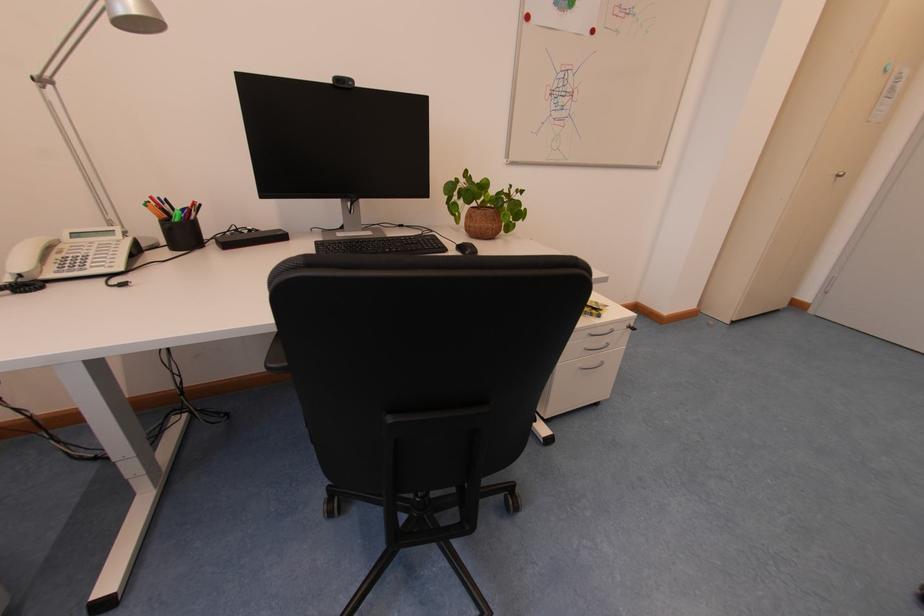
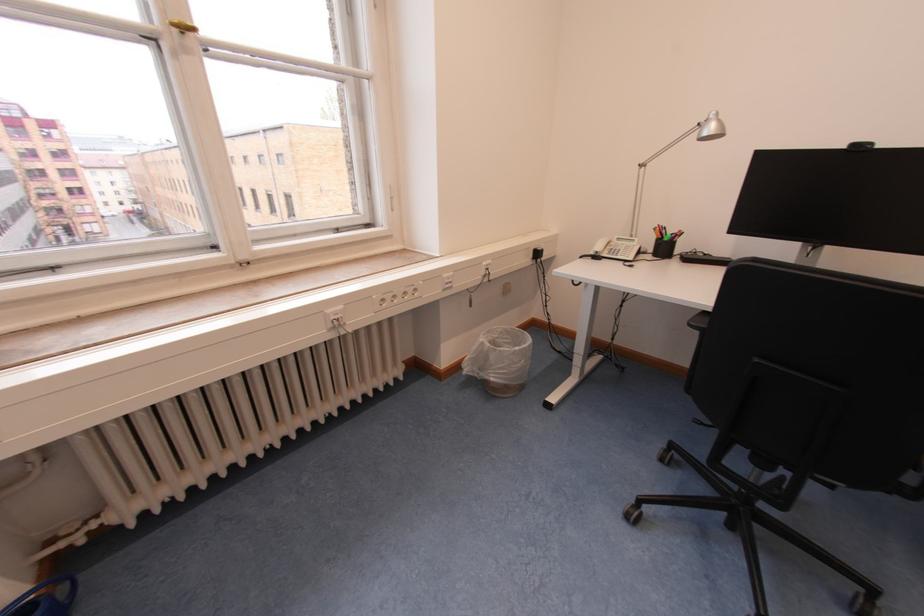
Find the pixel in the second image that matches point 81,238 in the first image.

(625, 241)